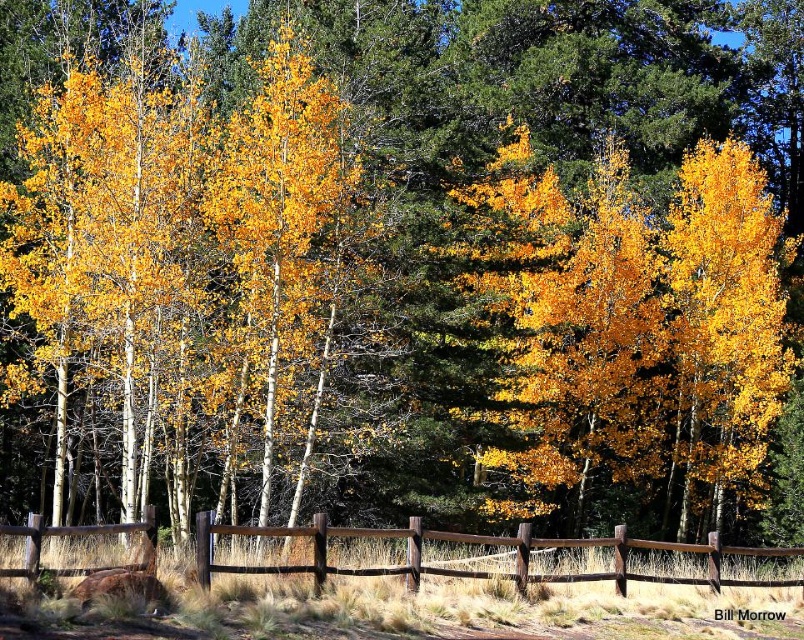
Question: Which point is farther from the camera taking this photo?

Choices:
 (A) (706, 202)
 (B) (419, 564)
 (C) (297, 48)

Answer: (A)

Question: Can you confirm if golden yellow bark birch at center is wider than matte yellow birch at right?

Choices:
 (A) no
 (B) yes

Answer: (A)

Question: Considering the real-world distances, which object is closest to the matte yellow birch at right?

Choices:
 (A) golden yellow bark birch at center
 (B) brown wooden fence at center

Answer: (B)

Question: Does matte yellow birch at right have a smaller size compared to brown wooden fence at center?

Choices:
 (A) no
 (B) yes

Answer: (A)

Question: Considering the real-world distances, which object is closest to the matte yellow birch at right?

Choices:
 (A) golden yellow bark birch at center
 (B) brown wooden fence at center

Answer: (B)

Question: In this image, where is matte yellow birch at right located relative to brown wooden fence at center?

Choices:
 (A) right
 (B) left

Answer: (A)